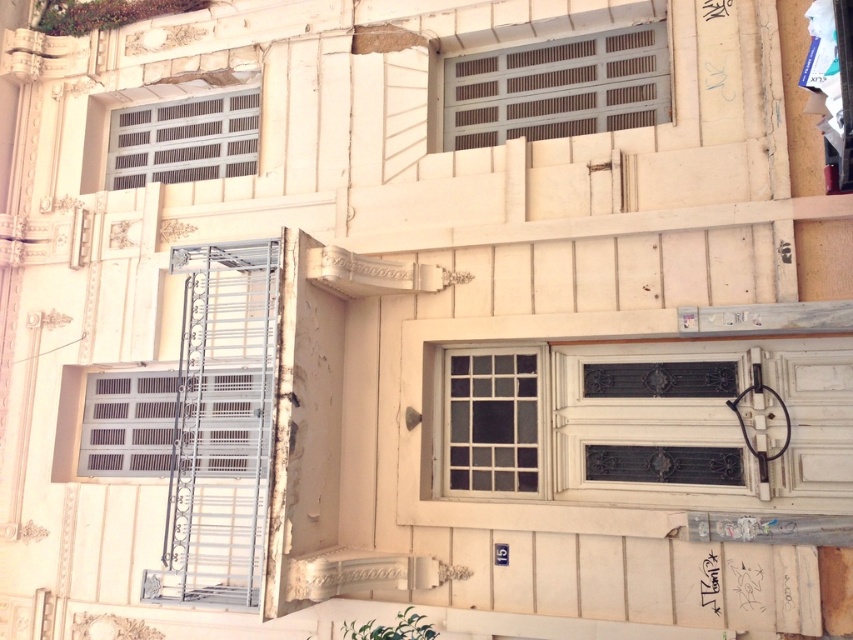
Question: Does metallic gray window at upper center have a lesser width compared to white glass window at center?

Choices:
 (A) yes
 (B) no

Answer: (B)

Question: Which of these objects is positioned closest to the metallic gray shutter at upper center?

Choices:
 (A) metallic gray window at upper center
 (B) white glass window at center

Answer: (A)

Question: Which object is the farthest from the white glass window at center?

Choices:
 (A) white painted metal at center
 (B) metallic gray shutter at upper center

Answer: (B)

Question: Which is farther from the metallic gray shutter at upper center?

Choices:
 (A) metallic gray window at upper center
 (B) white glass window at center
 (C) white painted metal at center

Answer: (B)

Question: Does white painted metal at center appear over metallic gray shutter at upper center?

Choices:
 (A) yes
 (B) no

Answer: (B)

Question: Can you confirm if metallic gray window at upper center is thinner than white glass window at center?

Choices:
 (A) no
 (B) yes

Answer: (A)